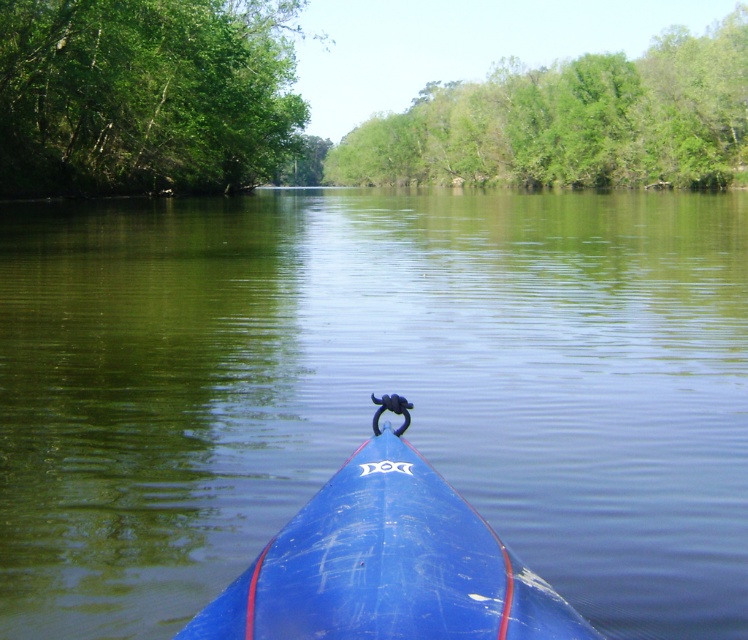
Which is below, green leafy trees at upper left or green leafy trees at upper center?

Positioned lower is green leafy trees at upper left.

Can you confirm if green leafy trees at upper left is bigger than green leafy trees at upper center?

No.

Is point (58, 29) less distant than point (444, 163)?

That is True.

Image resolution: width=748 pixels, height=640 pixels. Find the location of `green leafy trees at upper left`. green leafy trees at upper left is located at coordinates coord(144,93).

Between point (542, 141) and point (390, 593), which one is positioned in front?

Point (390, 593)

Where is `green leafy trees at upper center`? The image size is (748, 640). green leafy trees at upper center is located at coordinates (571, 122).

Which is behind, point (695, 621) or point (61, 77)?

Point (61, 77)

Between green smooth water at center and green leafy trees at upper left, which one is positioned lower?

green smooth water at center

The image size is (748, 640). What are the coordinates of `green smooth water at center` in the screenshot? It's located at (373, 390).

In order to click on green smooth water at center in this screenshot , I will do click(373, 390).